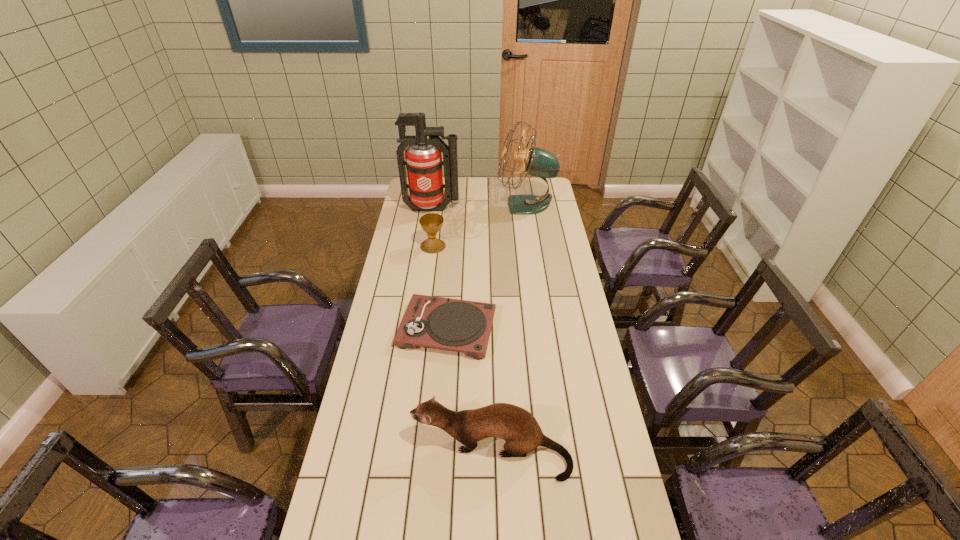
This screenshot has height=540, width=960. I want to click on fire extinguisher, so click(x=423, y=157).

The height and width of the screenshot is (540, 960). I want to click on fan, so [538, 162].

Locate an element on the screen. ferret is located at coordinates (518, 427).

Where is `the nearest object`? The image size is (960, 540). the nearest object is located at coordinates (518, 427).

In order to click on chalice in this screenshot , I will do `click(431, 223)`.

The image size is (960, 540). In order to click on the third farthest object in this screenshot , I will do click(431, 223).

Where is `the shortest object`? This screenshot has height=540, width=960. the shortest object is located at coordinates (456, 325).

Image resolution: width=960 pixels, height=540 pixels. I want to click on phonograph_record, so click(456, 325).

You are a GUI agent. You are given a task and a screenshot of the screen. Output one action in this format:
    pyautogui.click(x=<x>, y=<y>)
    Task: Click on the free space located on the front label side of the fire extinguisher
    Image resolution: width=960 pixels, height=540 pixels.
    Given the screenshot: What is the action you would take?
    pyautogui.click(x=430, y=224)

At what (x,y) coordinates should I click in order to perform the action: click on free location located on the front-facing side of the fan for air flow. Please return your answer as a coordinate pair (x, y). The image size is (960, 540). Looking at the image, I should click on (441, 205).